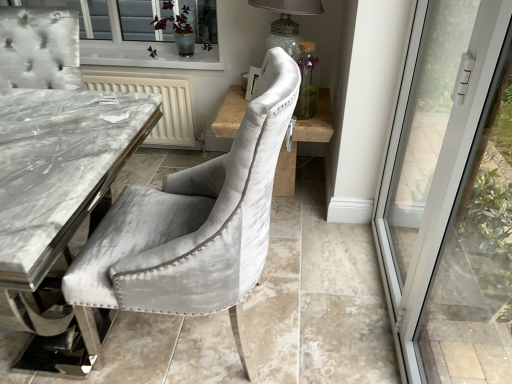
Question: Does light brown wood side table at center have a lesser height compared to velvet grey chair at center?

Choices:
 (A) yes
 (B) no

Answer: (A)

Question: Can you confirm if light brown wood side table at center is smaller than velvet grey chair at center?

Choices:
 (A) yes
 (B) no

Answer: (A)

Question: From a real-world perspective, is light brown wood side table at center located higher than velvet grey chair at center?

Choices:
 (A) no
 (B) yes

Answer: (A)

Question: Is velvet grey chair at center located within light brown wood side table at center?

Choices:
 (A) no
 (B) yes

Answer: (A)

Question: Is light brown wood side table at center next to velvet grey chair at center and touching it?

Choices:
 (A) yes
 (B) no

Answer: (B)

Question: From the image's perspective, does light brown wood side table at center appear lower than velvet grey chair at center?

Choices:
 (A) yes
 (B) no

Answer: (B)

Question: Considering the relative positions of velvet grey chair at center and transparent glass door at right in the image provided, is velvet grey chair at center to the left of transparent glass door at right from the viewer's perspective?

Choices:
 (A) no
 (B) yes

Answer: (B)

Question: From the image's perspective, would you say velvet grey chair at center is shown under transparent glass door at right?

Choices:
 (A) yes
 (B) no

Answer: (A)

Question: Are velvet grey chair at center and transparent glass door at right beside each other?

Choices:
 (A) no
 (B) yes

Answer: (A)

Question: Would you consider velvet grey chair at center to be distant from transparent glass door at right?

Choices:
 (A) yes
 (B) no

Answer: (B)

Question: Considering the relative sizes of velvet grey chair at center and transparent glass door at right in the image provided, is velvet grey chair at center taller than transparent glass door at right?

Choices:
 (A) yes
 (B) no

Answer: (B)

Question: Considering the relative positions of velvet grey chair at center and transparent glass door at right in the image provided, is velvet grey chair at center behind transparent glass door at right?

Choices:
 (A) no
 (B) yes

Answer: (B)

Question: From the image's perspective, does velvet chair at center appear higher than purple velvet plant at upper center?

Choices:
 (A) yes
 (B) no

Answer: (B)